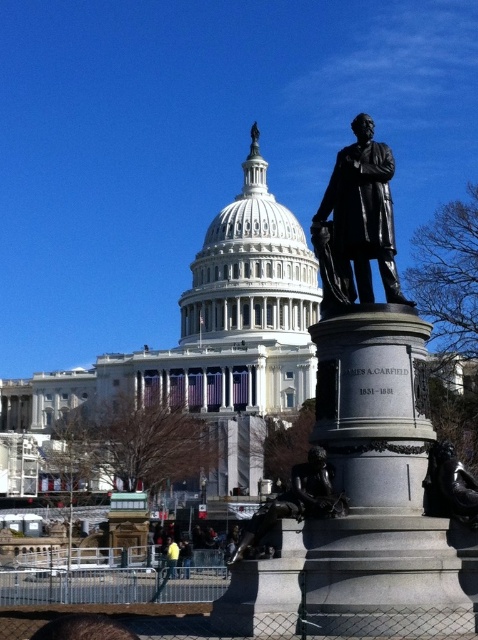
Question: Which is farther from the bronze statue at center?

Choices:
 (A) yellow fabric at lower center
 (B) polished bronze statue at center

Answer: (A)

Question: Considering the relative positions of bronze statue at right and yellow fabric at lower center in the image provided, where is bronze statue at right located with respect to yellow fabric at lower center?

Choices:
 (A) left
 (B) right

Answer: (B)

Question: Which object is closer to the camera taking this photo?

Choices:
 (A) bronze statue at center
 (B) yellow fabric at lower center

Answer: (A)

Question: Where is bronze statue at right located in relation to polished bronze statue at center in the image?

Choices:
 (A) below
 (B) above

Answer: (B)

Question: Which object appears farthest from the camera in this image?

Choices:
 (A) bronze statue at right
 (B) polished bronze statue at center
 (C) bronze statue at center
 (D) black polished statue at center

Answer: (A)

Question: Is polished bronze statue at center to the left of yellow fabric at lower center from the viewer's perspective?

Choices:
 (A) no
 (B) yes

Answer: (A)